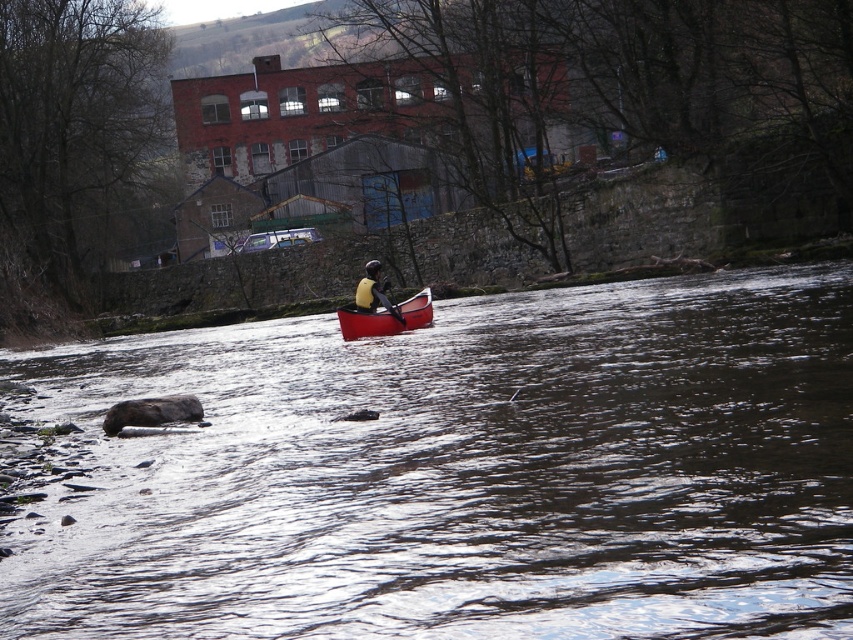
Question: Does smooth red canoe at center have a lesser width compared to matte yellow life vest at center?

Choices:
 (A) no
 (B) yes

Answer: (A)

Question: Which of the following is the closest to the observer?

Choices:
 (A) smooth red canoe at center
 (B) smooth plastic water at center
 (C) black plastic paddle at center
 (D) matte yellow life vest at center

Answer: (B)

Question: Can you confirm if smooth plastic water at center is positioned to the left of matte yellow life vest at center?

Choices:
 (A) yes
 (B) no

Answer: (B)

Question: From the image, what is the correct spatial relationship of matte yellow life vest at center in relation to black plastic paddle at center?

Choices:
 (A) left
 (B) right

Answer: (A)

Question: Considering the real-world distances, which object is closest to the smooth plastic water at center?

Choices:
 (A) matte yellow life vest at center
 (B) black plastic paddle at center
 (C) smooth red canoe at center

Answer: (C)

Question: Which of the following is the closest to the observer?

Choices:
 (A) black plastic paddle at center
 (B) smooth red canoe at center
 (C) matte yellow life vest at center

Answer: (A)